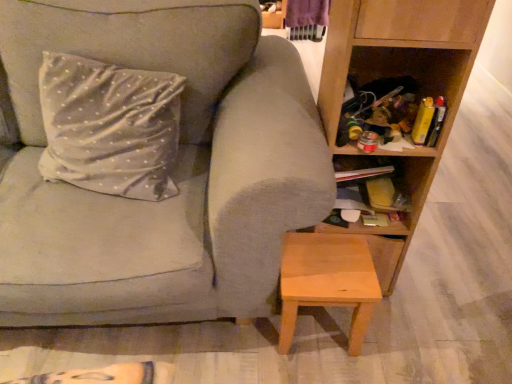
This screenshot has width=512, height=384. Identify the location of empty space that is ontop of wooden cabinet at lower right (from a real-world perspective). (364, 180).